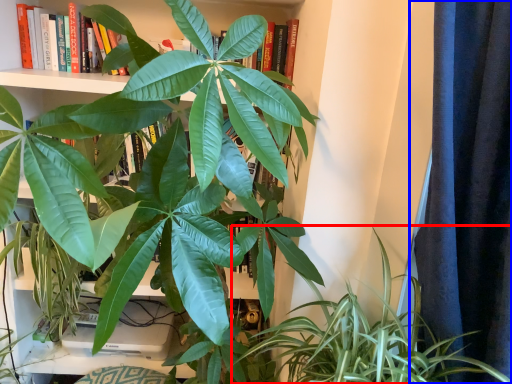
Question: Which object is further to the camera taking this photo, houseplant (highlighted by a red box) or curtain (highlighted by a blue box)?

Choices:
 (A) houseplant
 (B) curtain

Answer: (A)